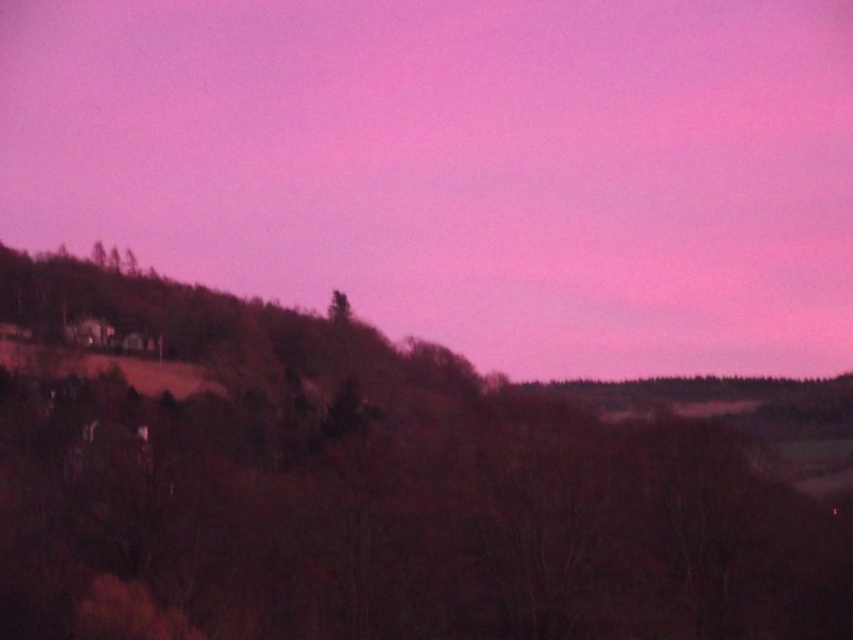
Question: Is matte pink sky at upper center closer to camera compared to brown matte tree at left?

Choices:
 (A) no
 (B) yes

Answer: (A)

Question: Can you confirm if brown matte tree at left is positioned above green matte tree at center?

Choices:
 (A) no
 (B) yes

Answer: (A)

Question: Based on their relative distances, which object is nearer to the brown matte tree at left?

Choices:
 (A) matte pink sky at upper center
 (B) green matte tree at center

Answer: (B)

Question: Which of the following is the closest to the observer?

Choices:
 (A) (329, 310)
 (B) (39, 394)

Answer: (B)

Question: Is matte pink sky at upper center below brown matte tree at left?

Choices:
 (A) yes
 (B) no

Answer: (B)

Question: Which point appears closest to the camera in this image?

Choices:
 (A) (390, 6)
 (B) (511, 547)

Answer: (B)